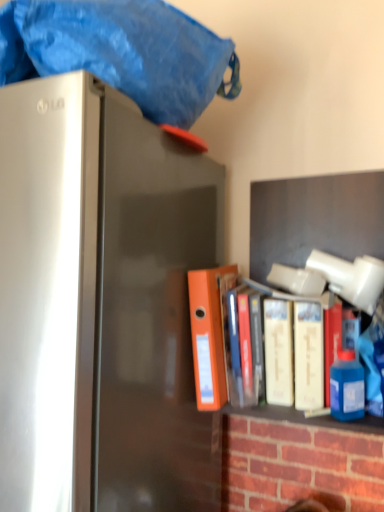
Question: From a real-world perspective, does satin silver refrigerator at left stand above orange matte folder at center, which is counted as the first book, starting from the left?

Choices:
 (A) no
 (B) yes

Answer: (A)

Question: Is satin silver refrigerator at left to the left of orange matte folder at center, which is the 2th book in right-to-left order, from the viewer's perspective?

Choices:
 (A) no
 (B) yes

Answer: (B)

Question: From the image's perspective, would you say satin silver refrigerator at left is positioned over orange matte folder at center, which is counted as the first book, starting from the left?

Choices:
 (A) yes
 (B) no

Answer: (B)

Question: Can you confirm if satin silver refrigerator at left is shorter than orange matte folder at center, which is the 2th book in right-to-left order?

Choices:
 (A) yes
 (B) no

Answer: (B)

Question: Considering the relative sizes of satin silver refrigerator at left and orange matte folder at center, which is counted as the first book, starting from the left, in the image provided, is satin silver refrigerator at left taller than orange matte folder at center, which is counted as the first book, starting from the left,?

Choices:
 (A) no
 (B) yes

Answer: (B)

Question: Is blue plastic bottle at right wider or thinner than white matte book at center, which is counted as the second book, starting from the left?

Choices:
 (A) thin
 (B) wide

Answer: (A)

Question: From a real-world perspective, is blue plastic bottle at right above or below white matte book at center, the 1th book viewed from the right?

Choices:
 (A) above
 (B) below

Answer: (B)

Question: From the image's perspective, is blue plastic bottle at right positioned above or below white matte book at center, which is counted as the second book, starting from the left?

Choices:
 (A) above
 (B) below

Answer: (B)

Question: Is point (352, 386) positioned closer to the camera than point (205, 315)?

Choices:
 (A) farther
 (B) closer

Answer: (B)

Question: From the image's perspective, is white matte book at center, the 1th book viewed from the right, above or below blue fabric at top?

Choices:
 (A) below
 (B) above

Answer: (A)

Question: Considering the positions of white matte book at center, the 1th book viewed from the right, and blue fabric at top in the image, is white matte book at center, the 1th book viewed from the right, wider or thinner than blue fabric at top?

Choices:
 (A) thin
 (B) wide

Answer: (A)

Question: From a real-world perspective, is white matte book at center, the 1th book viewed from the right, above or below blue fabric at top?

Choices:
 (A) below
 (B) above

Answer: (A)

Question: Relative to blue fabric at top, is white matte book at center, the 1th book viewed from the right, in front or behind?

Choices:
 (A) front
 (B) behind

Answer: (B)

Question: Considering the positions of orange matte folder at center, which is counted as the first book, starting from the left, and satin silver refrigerator at left in the image, is orange matte folder at center, which is counted as the first book, starting from the left, wider or thinner than satin silver refrigerator at left?

Choices:
 (A) wide
 (B) thin

Answer: (B)

Question: From the image's perspective, is orange matte folder at center, which is counted as the first book, starting from the left, positioned above or below satin silver refrigerator at left?

Choices:
 (A) above
 (B) below

Answer: (A)